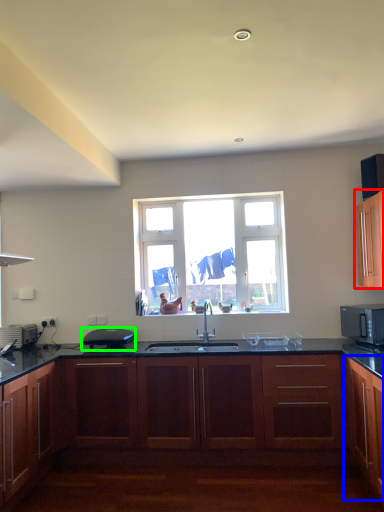
Question: Considering the real-world distances, which object is closest to cabinetry (highlighted by a red box)? cabinetry (highlighted by a blue box) or appliance (highlighted by a green box).

Choices:
 (A) cabinetry
 (B) appliance

Answer: (A)